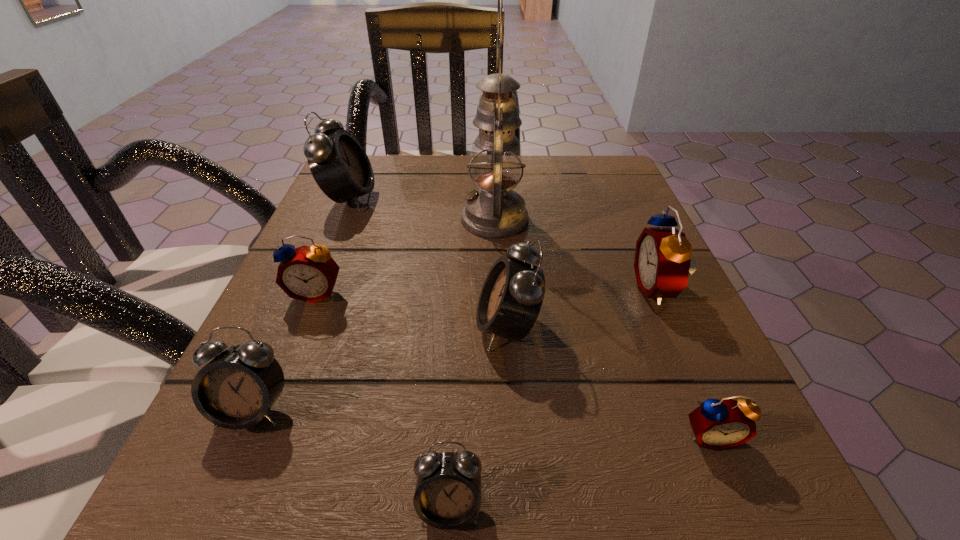
In order to click on oil lamp located at the far edge in this screenshot , I will do `click(495, 211)`.

Image resolution: width=960 pixels, height=540 pixels. Identify the location of alarm clock positioned at the far edge. (340, 166).

Where is `object present at the near edge`? object present at the near edge is located at coordinates (448, 494).

At what (x,y) coordinates should I click in order to perform the action: click on object that is at the far left corner. Please return your answer as a coordinate pair (x, y). This screenshot has height=540, width=960. Looking at the image, I should click on [340, 166].

This screenshot has width=960, height=540. Identify the location of free spot at the far edge of the desktop. (468, 158).

You are a GUI agent. You are given a task and a screenshot of the screen. Output one action in this format:
    pyautogui.click(x=<x>, y=<y>)
    Task: Click on the vacant space at the near edge
    The image size is (960, 540).
    Given the screenshot: What is the action you would take?
    pyautogui.click(x=355, y=465)

In the image, there is a desktop. What are the coordinates of `vacant region at the left edge` in the screenshot? It's located at (322, 383).

Where is `vacant region at the right edge of the desktop`? The image size is (960, 540). vacant region at the right edge of the desktop is located at coordinates (612, 324).

Where is `vacant space at the far left corner of the desktop`? vacant space at the far left corner of the desktop is located at coordinates (396, 201).

Where is `free spot at the near left corner of the desktop`? This screenshot has width=960, height=540. free spot at the near left corner of the desktop is located at coordinates pyautogui.click(x=293, y=511).